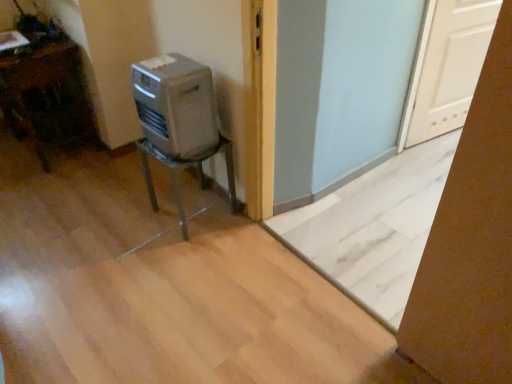
Question: Does white matte door at upper right turn towards metallic gray chair at center-left, which appears as the 2th furniture when viewed from the left?

Choices:
 (A) no
 (B) yes

Answer: (A)

Question: Is white matte door at upper right bigger than metallic gray chair at center-left, which is the first furniture in right-to-left order?

Choices:
 (A) yes
 (B) no

Answer: (B)

Question: Is white matte door at upper right outside of metallic gray chair at center-left, which appears as the 2th furniture when viewed from the left?

Choices:
 (A) no
 (B) yes

Answer: (B)

Question: Considering the relative sizes of white matte door at upper right and metallic gray chair at center-left, which appears as the 2th furniture when viewed from the left, in the image provided, is white matte door at upper right shorter than metallic gray chair at center-left, which appears as the 2th furniture when viewed from the left,?

Choices:
 (A) yes
 (B) no

Answer: (B)

Question: Is white matte door at upper right at the right side of metallic gray chair at center-left, which is the first furniture in right-to-left order?

Choices:
 (A) yes
 (B) no

Answer: (A)

Question: Relative to metallic gray chair at center-left, which appears as the 2th furniture when viewed from the left, is white matte door at upper right in front or behind?

Choices:
 (A) front
 (B) behind

Answer: (B)

Question: Is point (471, 4) positioned closer to the camera than point (148, 167)?

Choices:
 (A) closer
 (B) farther

Answer: (B)

Question: Considering the relative positions of white matte door at upper right and metallic gray chair at center-left, which is the first furniture in right-to-left order, in the image provided, is white matte door at upper right to the left or to the right of metallic gray chair at center-left, which is the first furniture in right-to-left order,?

Choices:
 (A) left
 (B) right

Answer: (B)

Question: Looking at the image, does white matte door at upper right seem bigger or smaller compared to metallic gray chair at center-left, which is the first furniture in right-to-left order?

Choices:
 (A) small
 (B) big

Answer: (A)

Question: Considering their positions, is metallic gray chair at center-left, which is the first furniture in right-to-left order, located in front of or behind silver metallic heater at center?

Choices:
 (A) front
 (B) behind

Answer: (B)

Question: In the image, is metallic gray chair at center-left, which is the first furniture in right-to-left order, on the left side or the right side of silver metallic heater at center?

Choices:
 (A) left
 (B) right

Answer: (B)

Question: Is metallic gray chair at center-left, which appears as the 2th furniture when viewed from the left, inside the boundaries of silver metallic heater at center, or outside?

Choices:
 (A) outside
 (B) inside

Answer: (A)

Question: Considering the positions of metallic gray chair at center-left, which appears as the 2th furniture when viewed from the left, and silver metallic heater at center in the image, is metallic gray chair at center-left, which appears as the 2th furniture when viewed from the left, taller or shorter than silver metallic heater at center?

Choices:
 (A) tall
 (B) short

Answer: (A)

Question: Does point (197, 82) appear closer or farther from the camera than point (474, 87)?

Choices:
 (A) farther
 (B) closer

Answer: (B)

Question: Considering the positions of silver metallic heater at center and white matte door at upper right in the image, is silver metallic heater at center taller or shorter than white matte door at upper right?

Choices:
 (A) tall
 (B) short

Answer: (B)